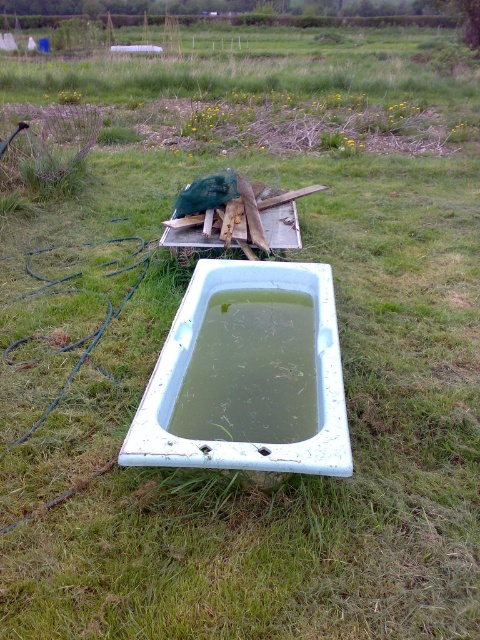
You are standing in the garden and see the white porcelain tub at center and the green murky water at center. Which object is positioned to the right side?

The white porcelain tub at center is to the right of the green murky water at center, so the white porcelain tub at center is positioned to the right side.

You are a painter who wants to paint the white porcelain tub at center and the green murky water at center. Which object should you focus on first if you want to paint the wider one first?

The white porcelain tub at center might be wider than green murky water at center, so you should focus on painting the white porcelain tub at center first.

You are a painter standing in front of the white porcelain tub at center and the green murky water at center. You want to paint the tub first. Which object should you paint first based on their positions?

The white porcelain tub at center is in front of the green murky water at center, so you should paint the white porcelain tub at center first to avoid covering it when painting the water behind.